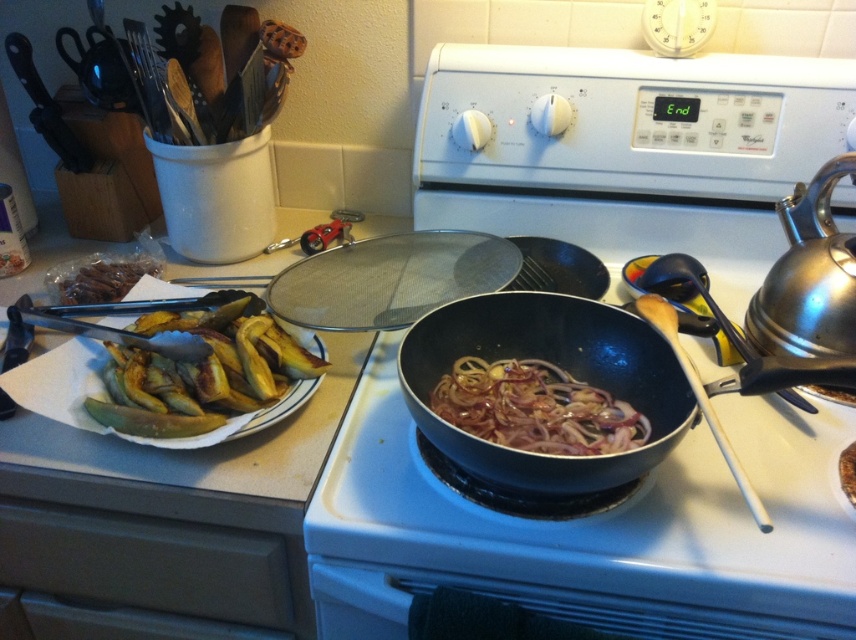
You are a chef preparing to boil water for pasta. You have a shiny metallic kettle at right and a metallic mesh strainer at upper center. Which object should you use to boil the water, and why?

You should use the shiny metallic kettle at right to boil water because it is designed for heating water, while the metallic mesh strainer at upper center is used for draining liquids from food.

You are a chef standing in the kitchen. You need to reach the point at coordinates (361, 275). Can you estimate if this point is within your arm reach?

The point at coordinates (361, 275) is 36.61 inches away from the camera. Since the average human arm length is about 25 to 30 inches, this point is likely out of arm reach.

You are a chef preparing a dish and need to place the slightly translucent dark brown onions at center next to the white glossy oven at center. Given their sizes, will the onions fit to the right of the oven without overlapping?

The white glossy oven at center is wider than the slightly translucent dark brown onions at center. Therefore, placing the onions to the right of the oven would not cause overlapping since the oven takes up more space horizontally.